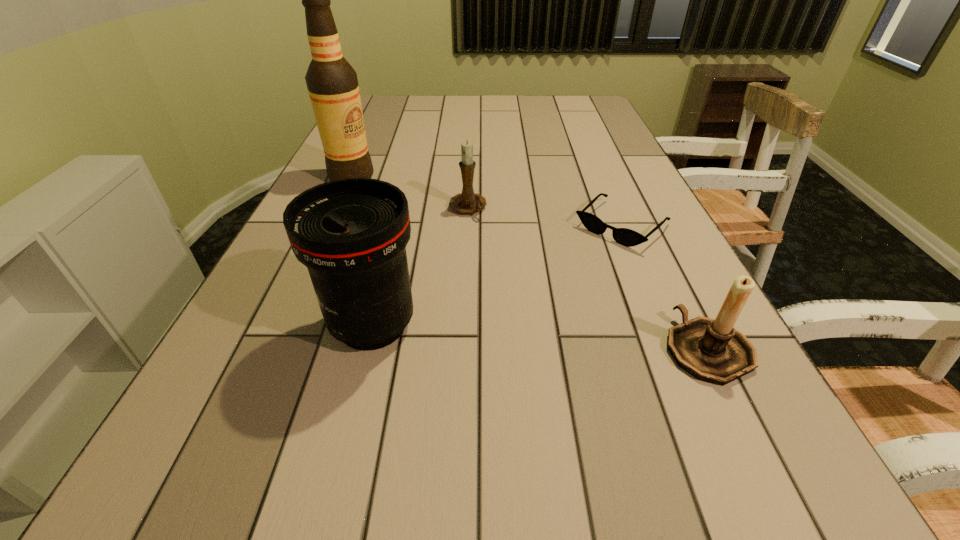
At what (x,y) coordinates should I click in order to perform the action: click on vacant space that satisfies the following two spatial constraints: 1. on the front side of the sunglasses; 2. on the right side of the right candle holder. Please return your answer as a coordinate pair (x, y). The height and width of the screenshot is (540, 960). Looking at the image, I should click on (674, 349).

The height and width of the screenshot is (540, 960). I want to click on free region that satisfies the following two spatial constraints: 1. on the front side of the nearer candle holder; 2. on the right side of the alcohol, so click(274, 349).

Identify the location of free location that satisfies the following two spatial constraints: 1. on the front side of the fourth object from right to left; 2. on the left side of the alcohol. (285, 325).